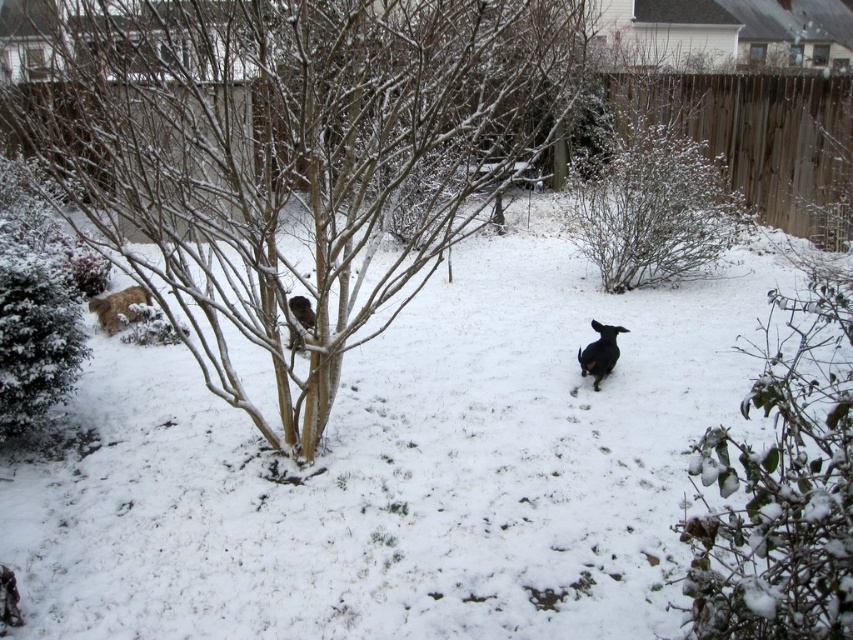
You are standing in the snowy backyard and want to walk from the green matte bush at left to the white fluffy snow at center. Which direction should you head?

You should head to the right because the white fluffy snow at center is to the right of the green matte bush at left.

You are standing in the snowy backyard and want to place a small snowman exactly where the white fluffy snow at center is located. What are the coordinates where you should build the snowman?

The coordinates for the white fluffy snow at center are at point (402, 470), so you should build the snowman there.